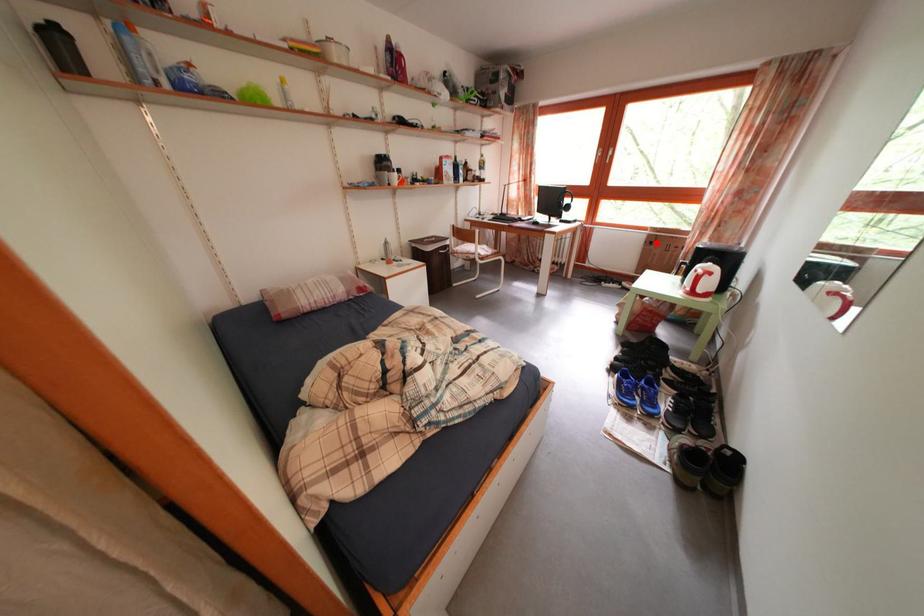
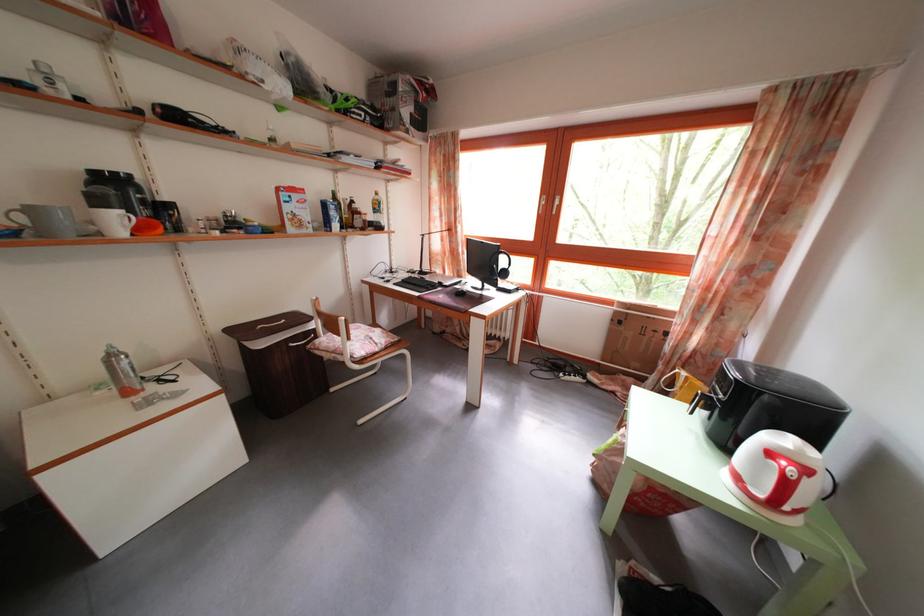
Question: I am providing you with two images of the same scene from different viewpoints. A red point is shown in image1. For the corresponding object point in image2, is it positioned nearer or farther from the camera?

Choices:
 (A) Nearer
 (B) Farther

Answer: (B)